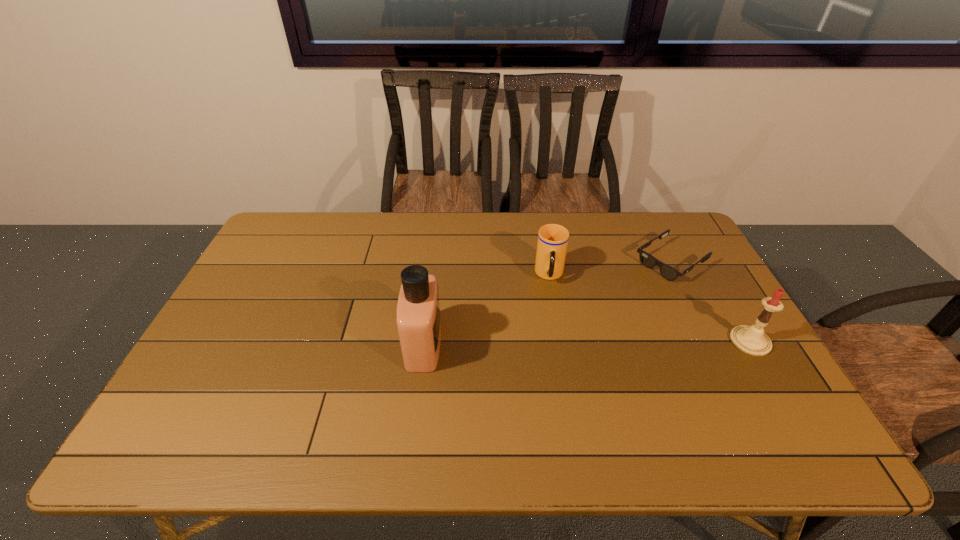
At what (x,y) coordinates should I click in order to perform the action: click on vacant space on the desktop that is between the leftmost object and the candle and is positioned on the temples of the sunglasses. Please return your answer as a coordinate pair (x, y). This screenshot has height=540, width=960. Looking at the image, I should click on [x=548, y=343].

In order to click on vacant space on the desktop that is between the tallest object and the candle and is positioned on the side of the third object from right to left with the handle in this screenshot , I will do `click(550, 343)`.